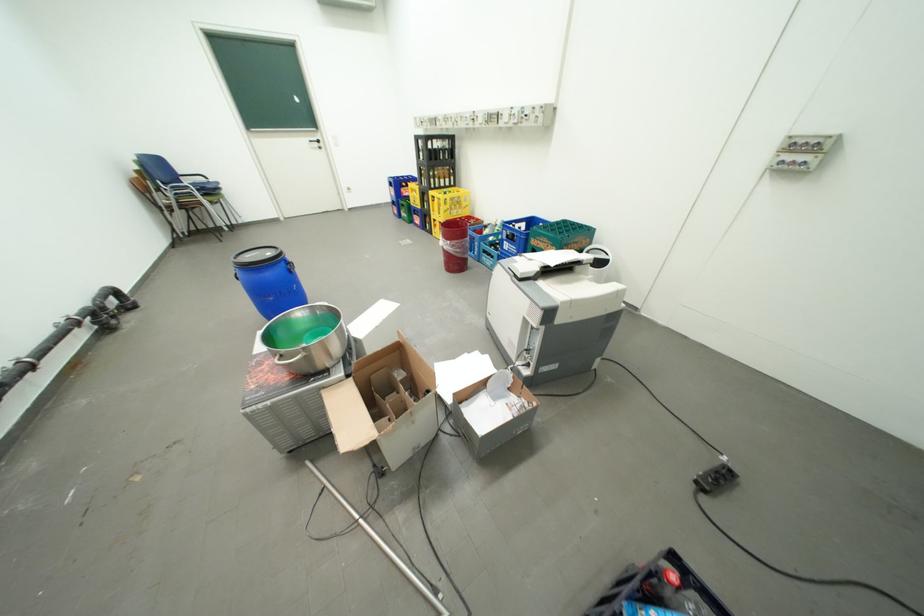
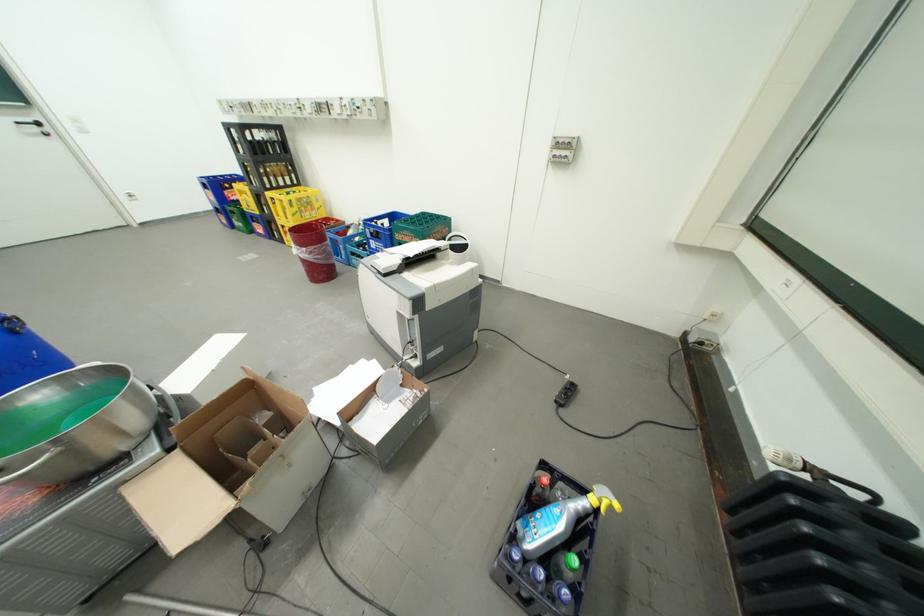
Locate, in the second image, the point that corresponds to the point at 336,305 in the first image.

(108, 365)